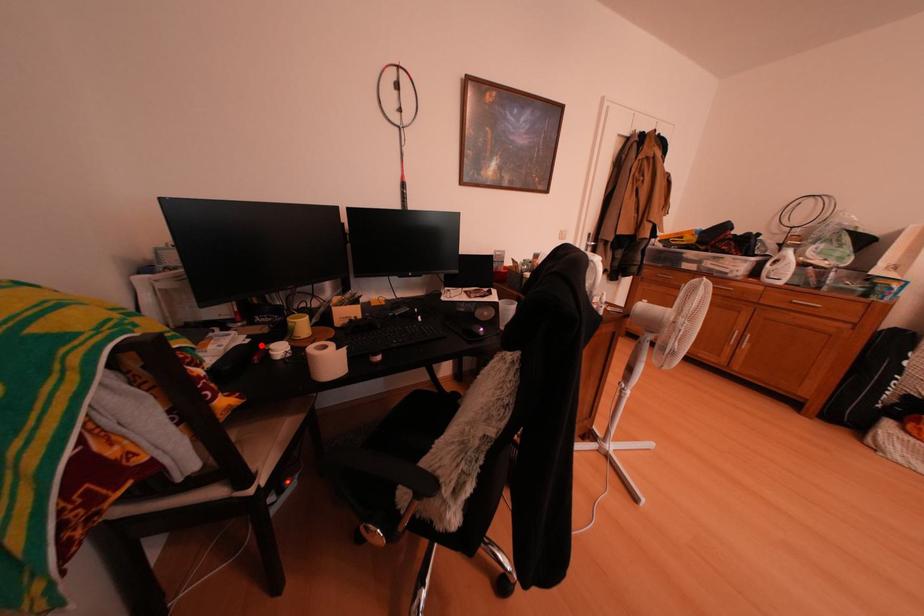
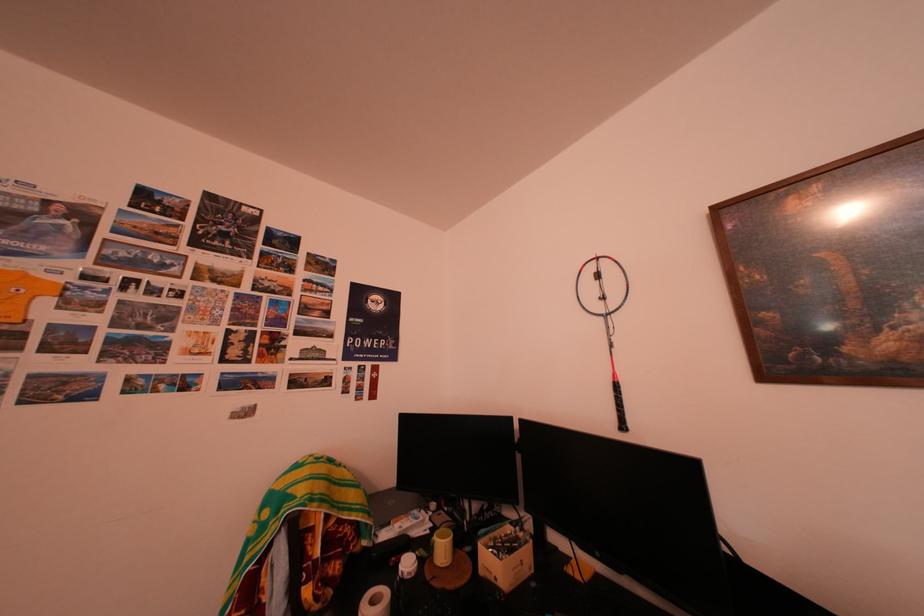
Where in the second image is the point corresponding to the highlighted location from the first image?

(441, 537)